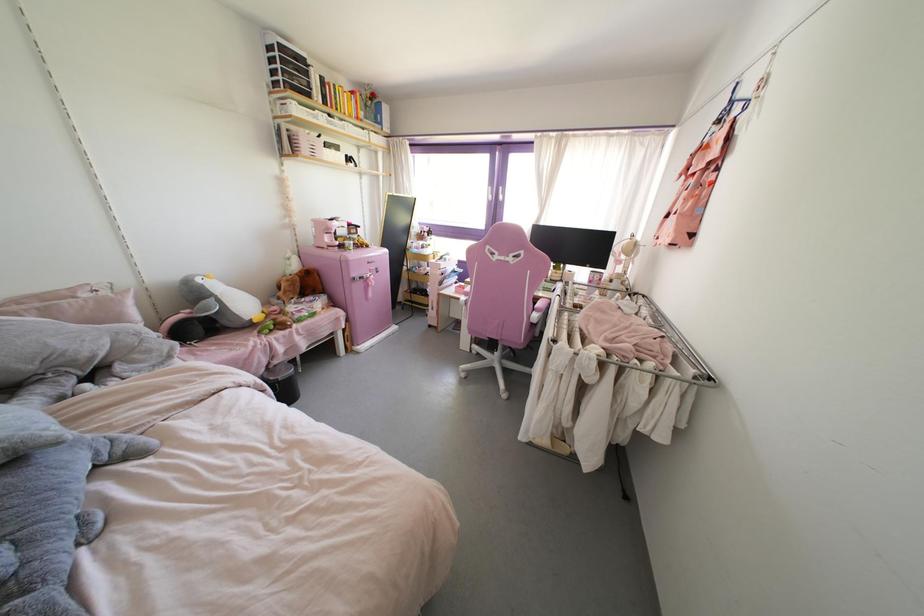
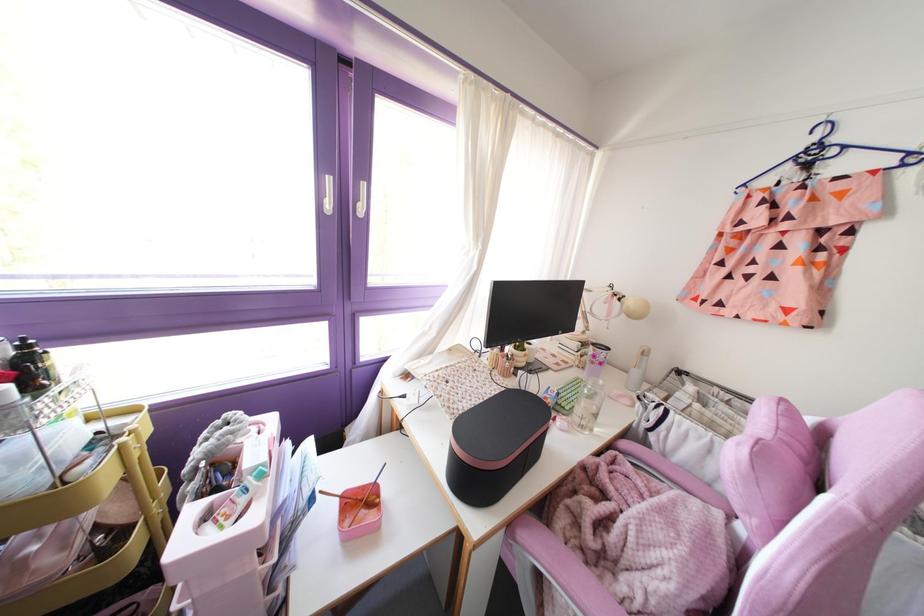
The point at (444, 259) is marked in the first image. Where is the corresponding point in the second image?

(261, 475)